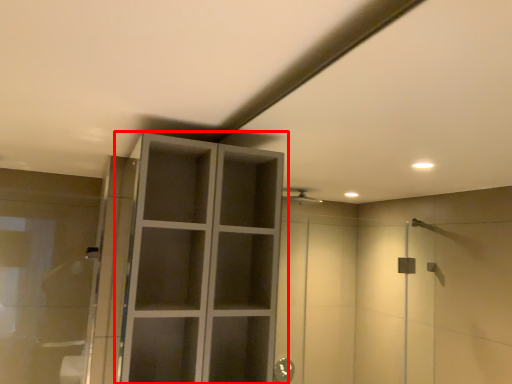
Question: Considering the relative positions of cupboard (annotated by the red box) and cabinetry in the image provided, where is cupboard (annotated by the red box) located with respect to the staircase?

Choices:
 (A) left
 (B) right

Answer: (B)